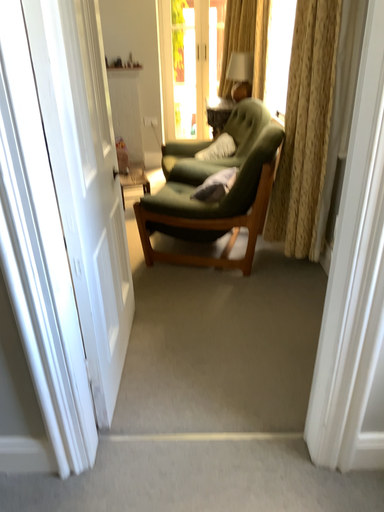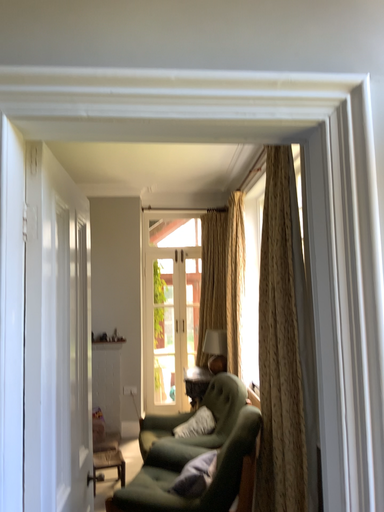
Question: Which way did the camera rotate in the video?

Choices:
 (A) rotated upward
 (B) rotated downward

Answer: (A)